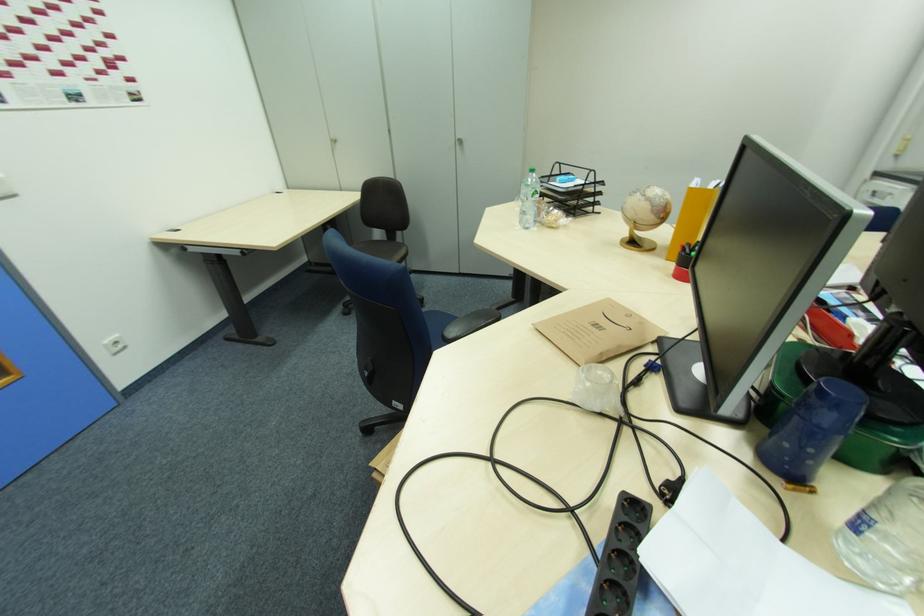
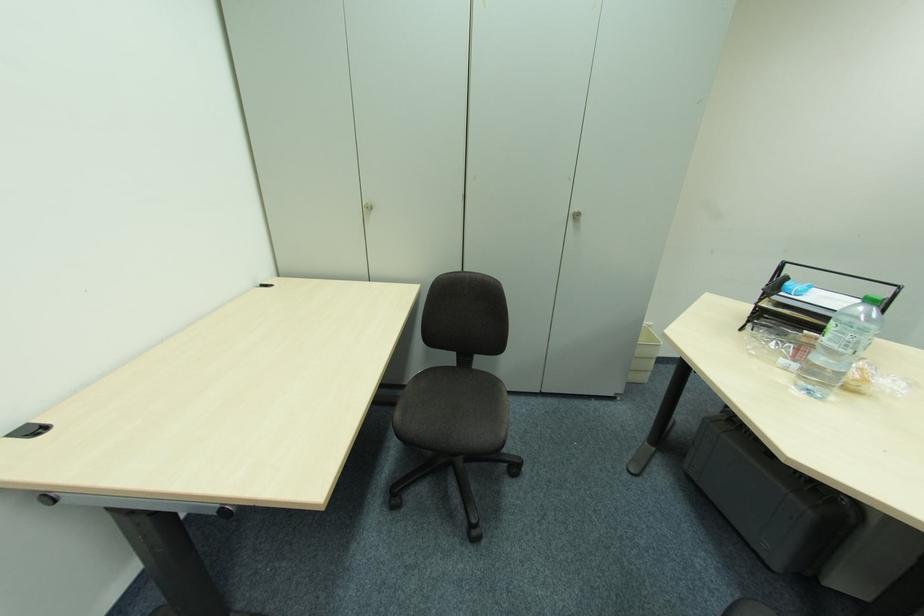
Find the pixel in the second image that matches the point at 529,197 in the first image.

(850, 347)